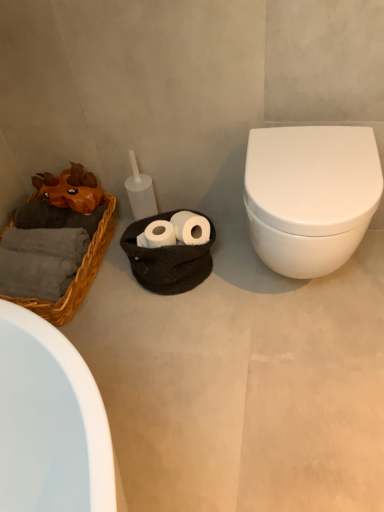
Where is `free point above white matte toilet at right (from a real-world perspective)`? This screenshot has height=512, width=384. free point above white matte toilet at right (from a real-world perspective) is located at coordinates (220, 353).